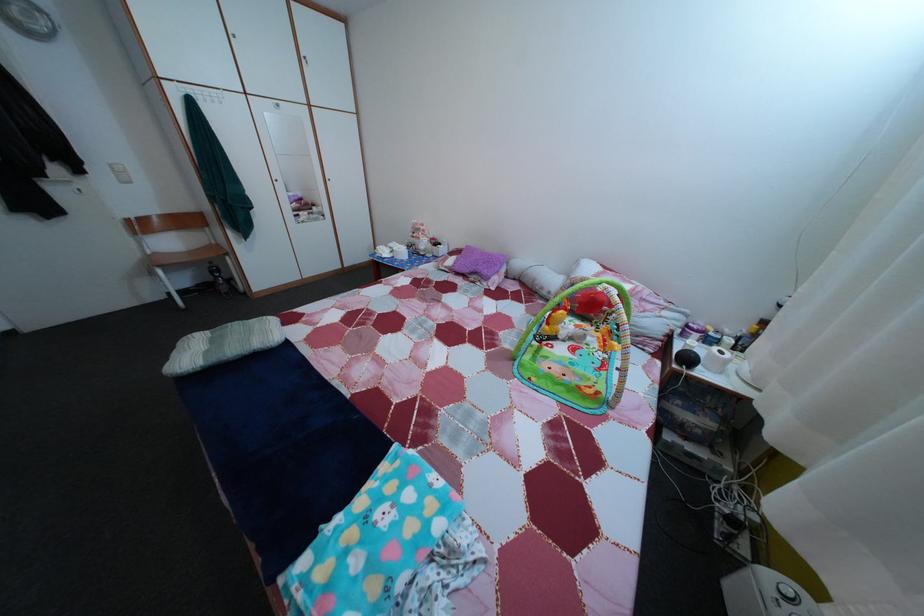
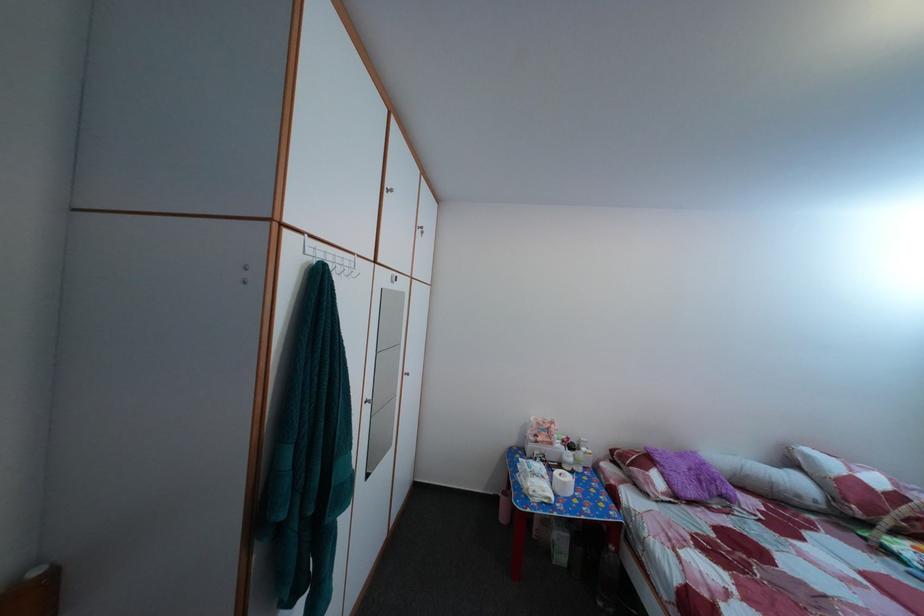
Question: I am providing you with two images of the same scene from different viewpoints. Please identify which objects are invisible in image2.

Choices:
 (A) white plastic bottle
 (B) white cylindrical pillow
 (C) purple fuzzy pillow
 (D) none of these

Answer: (D)